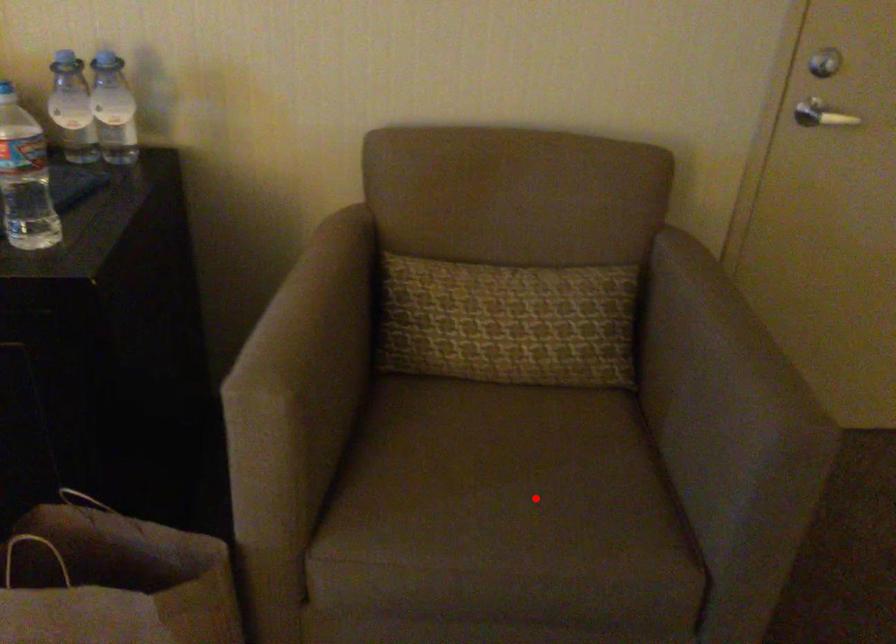
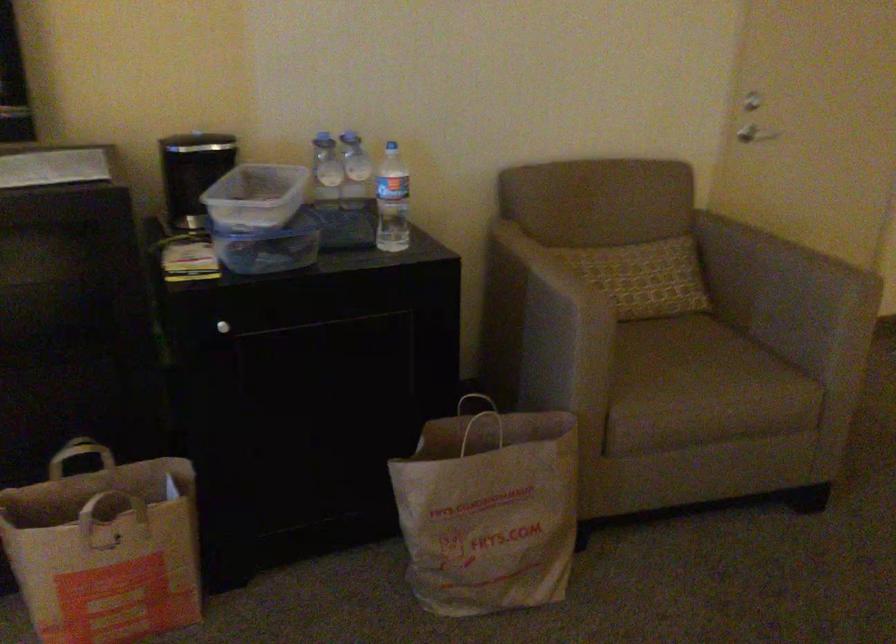
Locate, in the second image, the point that corresponds to the highlighted location in the first image.

(707, 366)